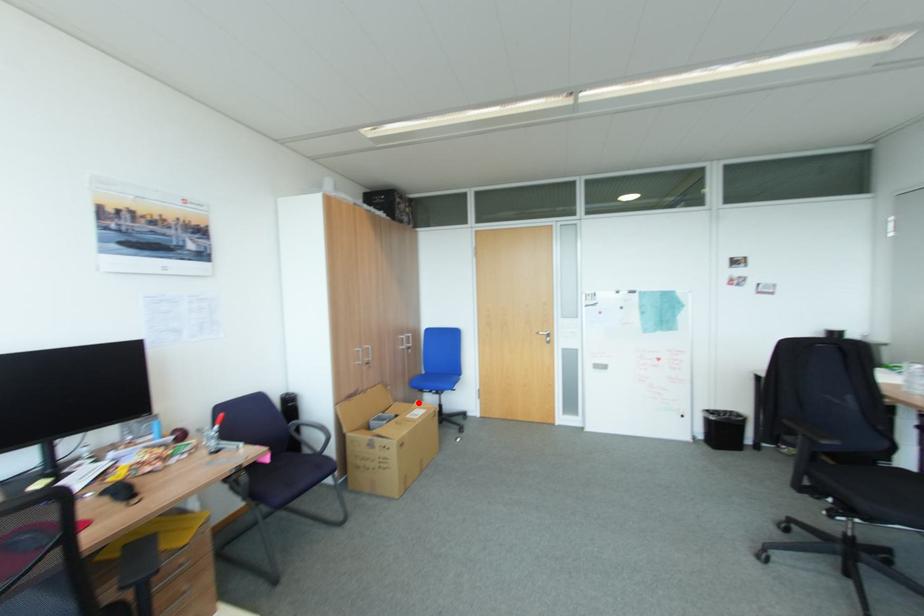
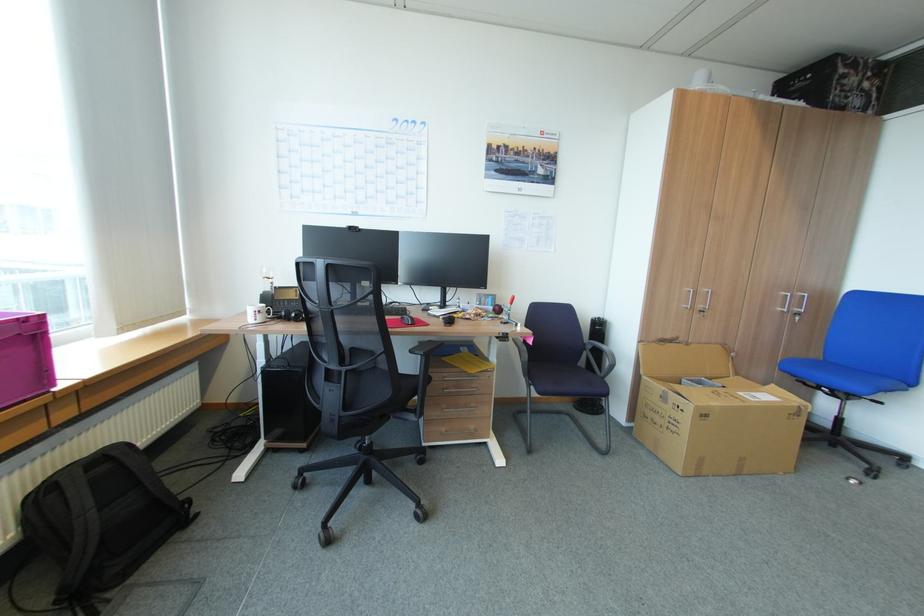
Question: I am providing you with two images of the same scene from different viewpoints. In image1, a red point is highlighted. Considering the same 3D point in image2, which of the following is correct?

Choices:
 (A) It is closer
 (B) It is farther

Answer: (B)